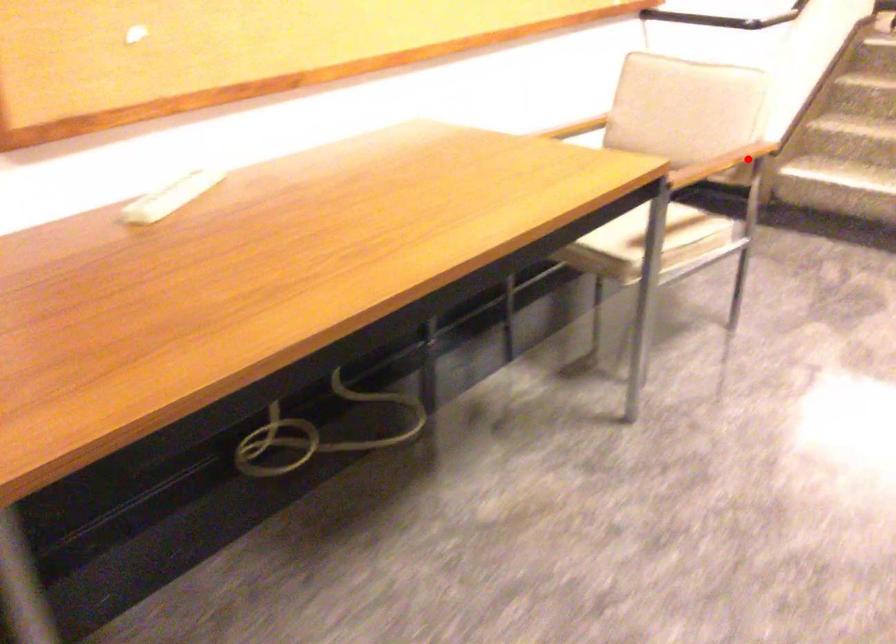
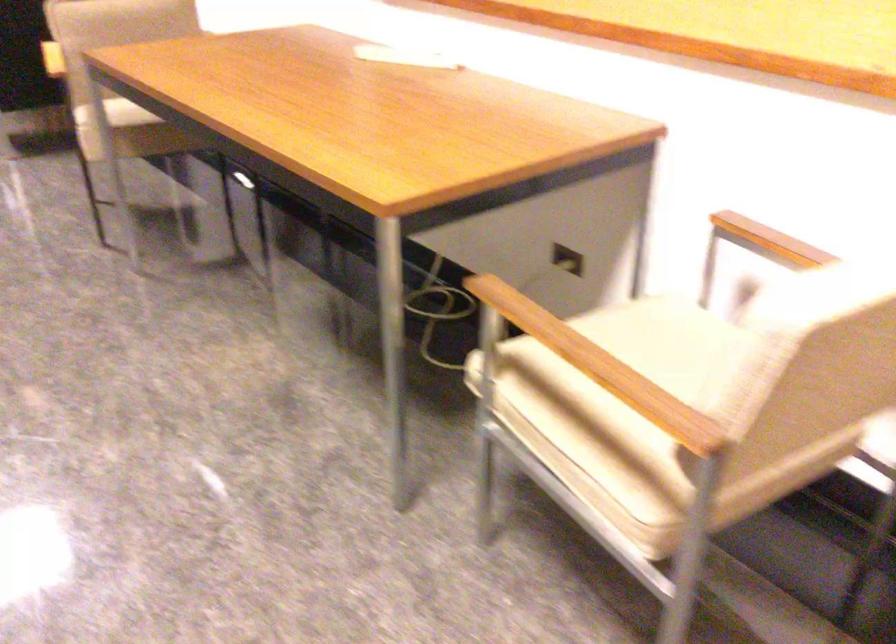
In the second image, find the point that corresponds to the highlighted location in the first image.

(619, 399)